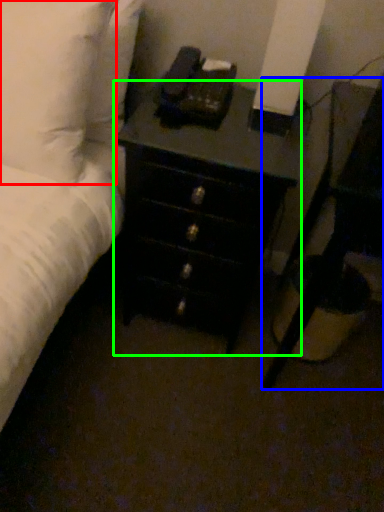
Question: Which object is positioned closest to pillow (highlighted by a red box)? Select from nightstand (highlighted by a blue box) and chest of drawers (highlighted by a green box).

Choices:
 (A) nightstand
 (B) chest of drawers

Answer: (B)